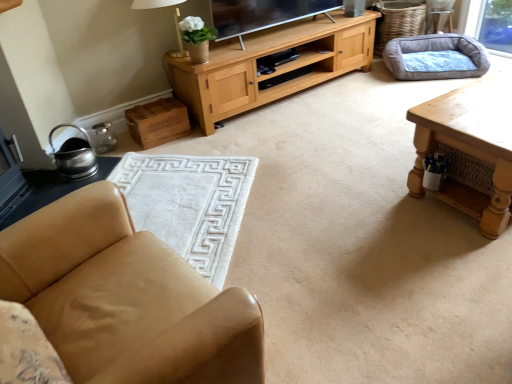
Question: Can we say white fabric lampshade at upper center lies outside light brown leather armchair at upper right?

Choices:
 (A) yes
 (B) no

Answer: (A)

Question: From the image's perspective, is white fabric lampshade at upper center over light brown leather armchair at upper right?

Choices:
 (A) yes
 (B) no

Answer: (B)

Question: Is white fabric lampshade at upper center shorter than light brown leather armchair at upper right?

Choices:
 (A) yes
 (B) no

Answer: (B)

Question: Considering the relative positions of white fabric lampshade at upper center and light brown leather armchair at upper right in the image provided, is white fabric lampshade at upper center behind light brown leather armchair at upper right?

Choices:
 (A) no
 (B) yes

Answer: (A)

Question: Is white fabric lampshade at upper center bigger than light brown leather armchair at upper right?

Choices:
 (A) no
 (B) yes

Answer: (B)

Question: Considering the positions of point (182, 155) and point (147, 1), is point (182, 155) closer or farther from the camera than point (147, 1)?

Choices:
 (A) farther
 (B) closer

Answer: (B)

Question: From the image's perspective, is white soft rug at lower left above or below white fabric lampshade at upper center?

Choices:
 (A) above
 (B) below

Answer: (B)

Question: In terms of height, does white soft rug at lower left look taller or shorter compared to white fabric lampshade at upper center?

Choices:
 (A) short
 (B) tall

Answer: (A)

Question: In the image, is white soft rug at lower left positioned in front of or behind white fabric lampshade at upper center?

Choices:
 (A) front
 (B) behind

Answer: (A)

Question: Which is correct: brushed metal side table at lower left is inside white fabric lampshade at upper center, or outside of it?

Choices:
 (A) inside
 (B) outside

Answer: (B)

Question: From a real-world perspective, is brushed metal side table at lower left above or below white fabric lampshade at upper center?

Choices:
 (A) below
 (B) above

Answer: (A)

Question: Based on their sizes in the image, would you say brushed metal side table at lower left is bigger or smaller than white fabric lampshade at upper center?

Choices:
 (A) big
 (B) small

Answer: (B)

Question: In the image, is brushed metal side table at lower left positioned in front of or behind white fabric lampshade at upper center?

Choices:
 (A) behind
 (B) front

Answer: (B)

Question: From the image's perspective, is brushed metal side table at lower left positioned above or below white soft rug at lower left?

Choices:
 (A) above
 (B) below

Answer: (A)

Question: Looking at the image, does brushed metal side table at lower left seem bigger or smaller compared to white soft rug at lower left?

Choices:
 (A) big
 (B) small

Answer: (B)